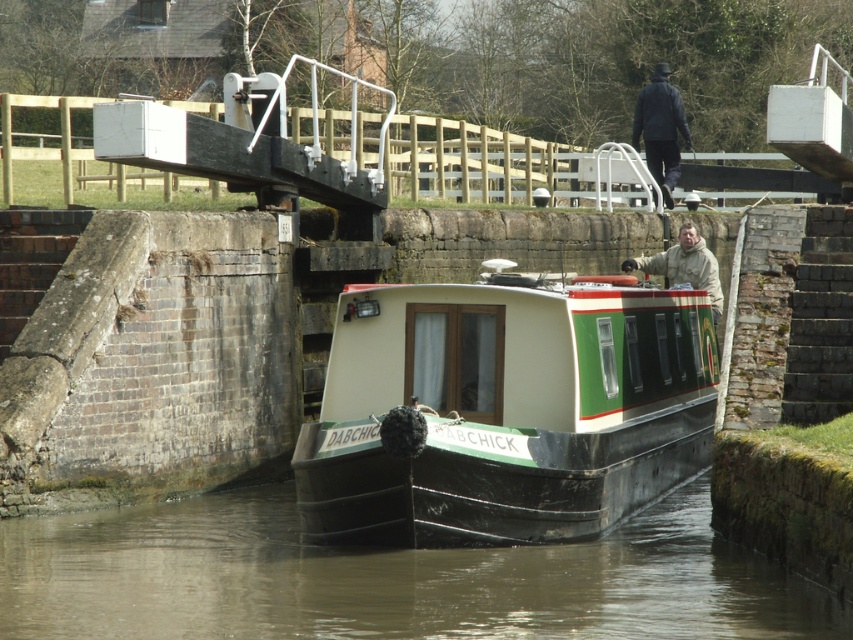
Question: Estimate the real-world distances between objects in this image. Which object is farther from the green matte houseboat at center?

Choices:
 (A) brown murky water at center
 (B) beige fuzzy jacket at upper center
 (C) dark blue jacket at upper center

Answer: (C)

Question: Does dark blue jacket at upper center have a larger size compared to beige fuzzy jacket at upper center?

Choices:
 (A) yes
 (B) no

Answer: (A)

Question: Is green matte houseboat at center further to the viewer compared to beige fuzzy jacket at upper center?

Choices:
 (A) yes
 (B) no

Answer: (B)

Question: Does brown murky water at center appear under dark blue jacket at upper center?

Choices:
 (A) yes
 (B) no

Answer: (A)

Question: Which point is farther to the camera?

Choices:
 (A) click(x=656, y=131)
 (B) click(x=341, y=502)
 (C) click(x=738, y=593)
 (D) click(x=689, y=243)

Answer: (A)

Question: Which point is farther to the camera?

Choices:
 (A) beige fuzzy jacket at upper center
 (B) dark blue jacket at upper center
 (C) brown murky water at center
 (D) green matte houseboat at center

Answer: (B)